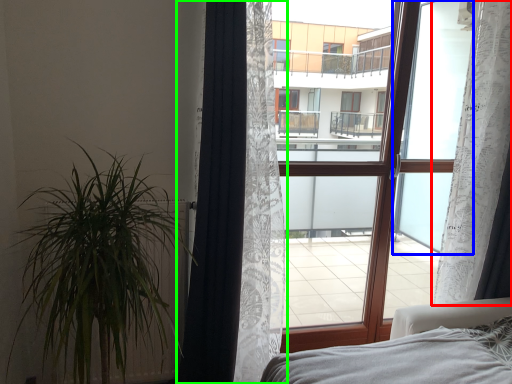
Question: Which object is positioned farthest from curtain (highlighted by a red box)? Select from window screen (highlighted by a blue box) and curtain (highlighted by a green box).

Choices:
 (A) window screen
 (B) curtain

Answer: (B)